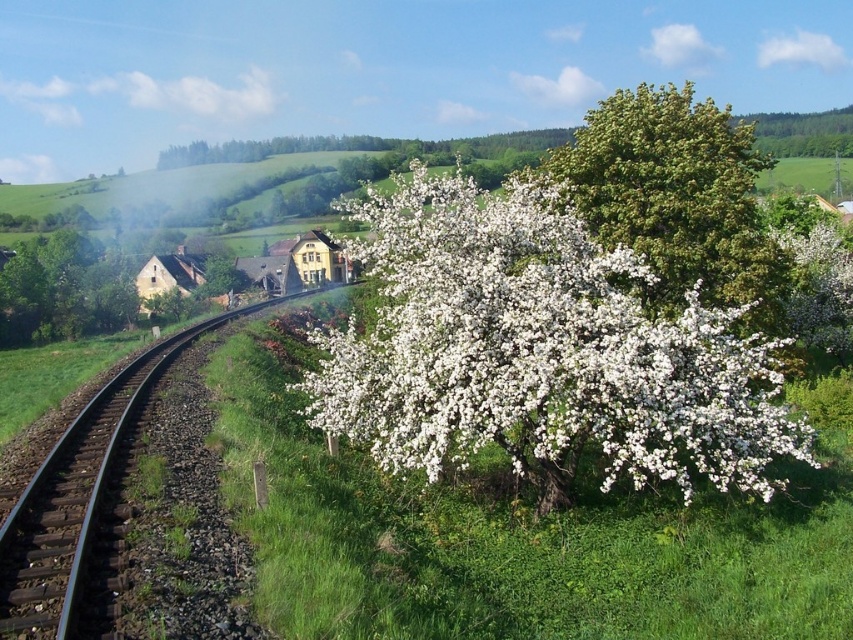
Is point (514, 232) positioned after point (692, 134)?

No, it is in front of (692, 134).

Who is positioned more to the left, white fluffy blossoms at center or green leafy tree at upper center?

white fluffy blossoms at center is more to the left.

This screenshot has width=853, height=640. What do you see at coordinates (540, 352) in the screenshot? I see `white fluffy blossoms at center` at bounding box center [540, 352].

Find the location of a particular element. This screenshot has height=640, width=853. white fluffy blossoms at center is located at coordinates (540, 352).

Is green leafy tree at upper center behind black metal train track at center?

Yes, green leafy tree at upper center is further from the viewer.

Is point (766, 298) farther from viewer compared to point (57, 440)?

Yes, it is behind point (57, 440).

Where is `green leafy tree at upper center`? The height and width of the screenshot is (640, 853). green leafy tree at upper center is located at coordinates (677, 198).

Is the position of white fluffy blossoms at center less distant than that of black metal train track at center?

No, white fluffy blossoms at center is behind black metal train track at center.

Who is more forward, (x=585, y=436) or (x=6, y=561)?

Positioned in front is point (x=6, y=561).

Where is `white fluffy blossoms at center`? white fluffy blossoms at center is located at coordinates (540, 352).